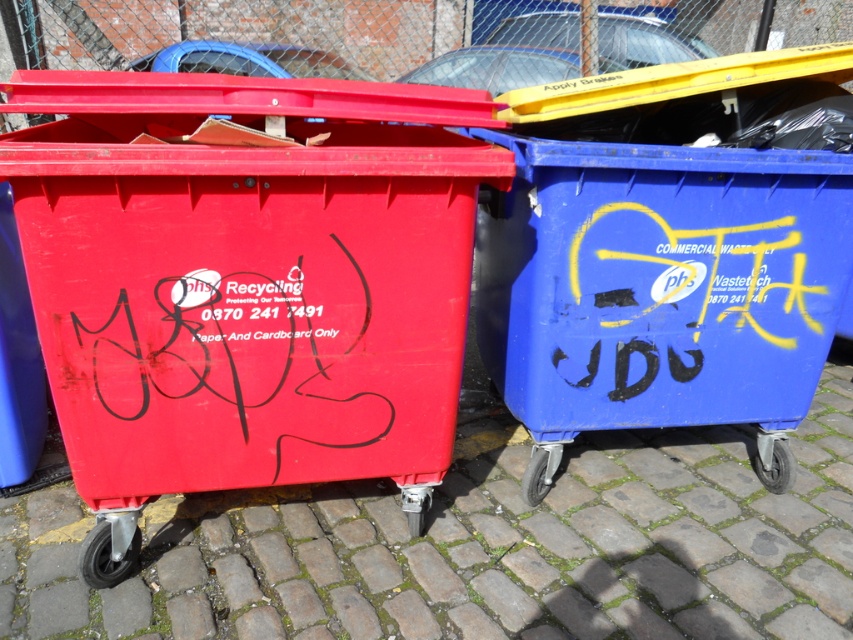
Question: Does matte plastic recycling bin at left come in front of matte plastic bin at center?

Choices:
 (A) yes
 (B) no

Answer: (A)

Question: Among these objects, which one is nearest to the camera?

Choices:
 (A) matte plastic bin at center
 (B) matte plastic recycling bin at left
 (C) cobblestone pavement at center

Answer: (B)

Question: Among these points, which one is farthest from the camera?

Choices:
 (A) (552, 576)
 (B) (338, 193)

Answer: (A)

Question: Considering the real-world distances, which object is closest to the matte plastic recycling bin at left?

Choices:
 (A) cobblestone pavement at center
 (B) matte plastic bin at center

Answer: (B)

Question: Does matte plastic recycling bin at left appear under cobblestone pavement at center?

Choices:
 (A) no
 (B) yes

Answer: (A)

Question: Is cobblestone pavement at center above matte plastic bin at center?

Choices:
 (A) yes
 (B) no

Answer: (B)